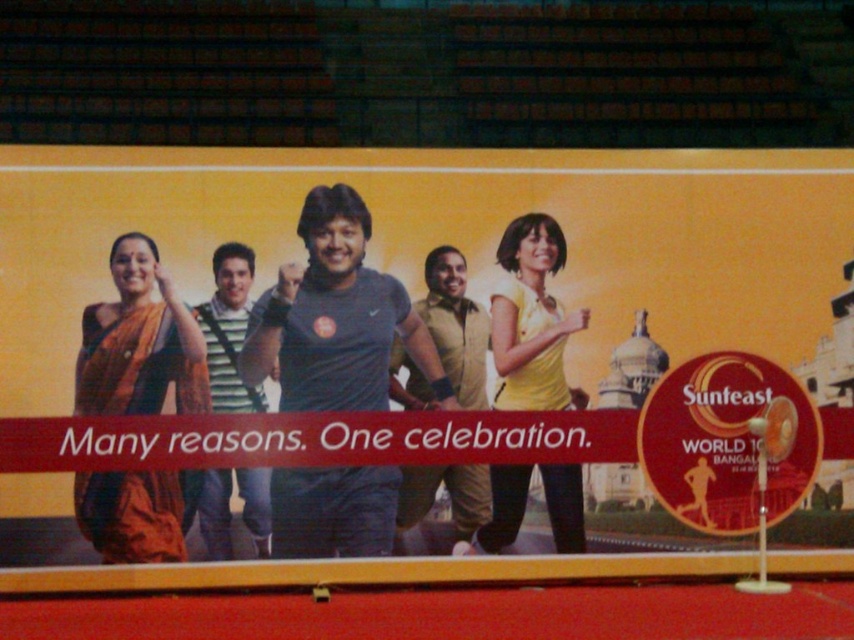
You are a photographer standing 10 feet away from the yellow matte dress at center and the tan suede vest at center. You want to take a photo that includes both objects in the frame. Can you position yourself so that both are visible without moving the subjects?

The yellow matte dress at center is 15.90 inches away from the tan suede vest at center. Since the distance between them is only about 15.90 inches, and you are 10 feet away, it should be possible to frame both in the photo without needing to move the subjects.

You are a photographer trying to capture the group photo of the matte orange saree at left and the yellow matte dress at center. Which one is located to the right side of the other?

The matte orange saree at left is positioned on the left side of yellow matte dress at center, so the yellow matte dress at center is to the right of the matte orange saree at left.

You are taking a photo of the two points in the Sunfeast advertisement. Which point, point 1 at coordinates (499, 524) or point 2 at (399, 497), is closer to your camera lens?

Point 1 at coordinates (499, 524) is closer to the camera lens than point 2 at (399, 497).